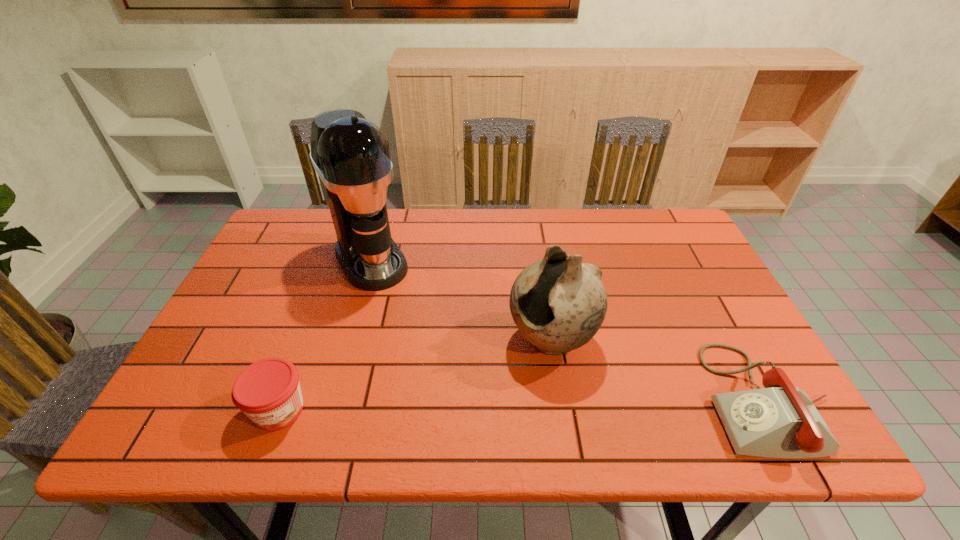
What are the coordinates of `vacant spot on the desktop that is between the jam and the telephone and is positioned place cup under the spout of the tallest object` in the screenshot? It's located at (463, 406).

At what (x,y) coordinates should I click in order to perform the action: click on vacant space on the desktop that is between the jam and the rightmost object and is positioned from the spout of the pottery. Please return your answer as a coordinate pair (x, y). Looking at the image, I should click on (x=467, y=406).